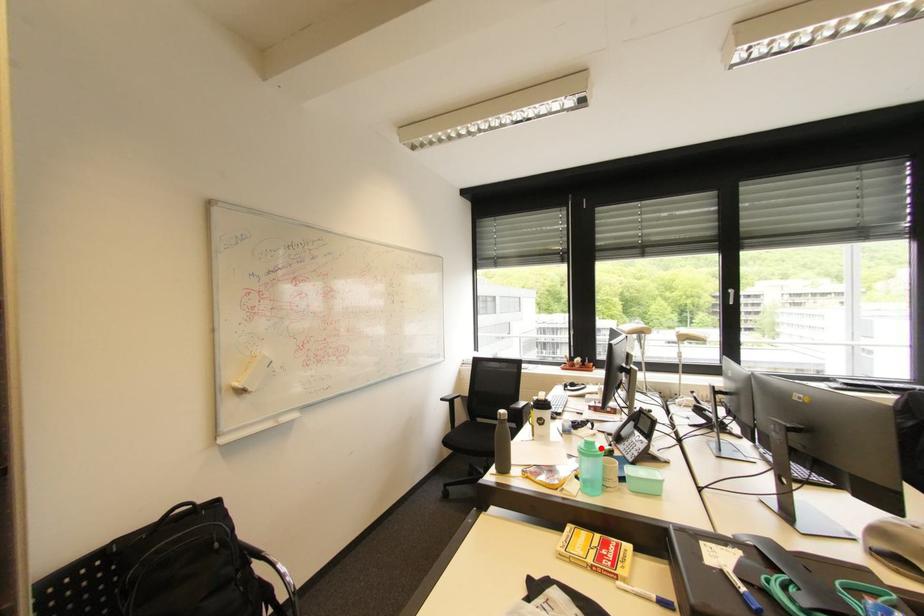
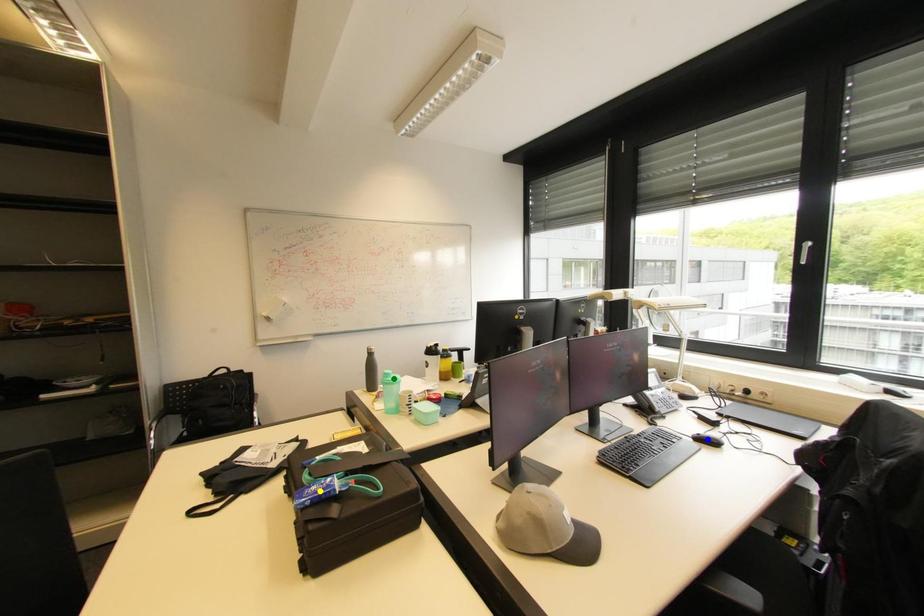
Question: I am providing you with two images of the same scene from different viewpoints. A red point is marked on the first image. You are given multiple points on the second image. In image 2, which mark is for the same physical point as the one in image 1?

Choices:
 (A) green point
 (B) blue point
 (C) yellow point

Answer: (A)